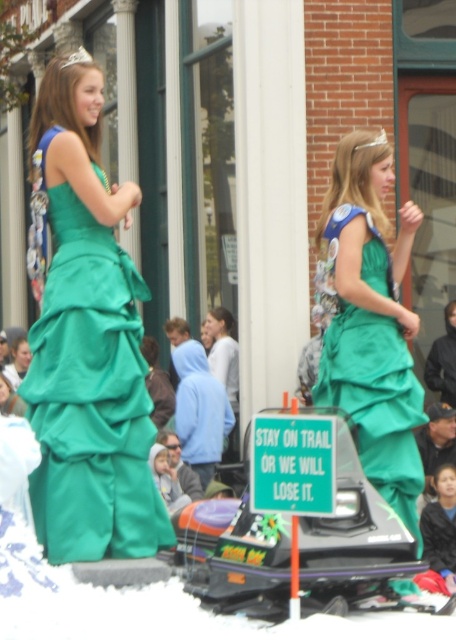
You are a photographer at the event and need to capture a clear photo of both the emerald satin dress at left and the green satin dress at center. Which dress will be more visible in the photo if you focus on the one that is closer to you?

The emerald satin dress at left is positioned over the green satin dress at center, so focusing on the emerald satin dress at left will make it more visible in the photo since it is closer to you.

You are at the parade and want to take a photo of the two points mentioned. Which point is closer to you, point (x=66, y=324) or point (x=412, y=365)?

Point (x=66, y=324) is in front of point (x=412, y=365), so it is closer to you.

You are a photographer at the event and want to capture the emerald satin dress at left. You see a point marked at coordinates point (x=91, y=397). Where is this point located relative to the emerald satin dress at left?

The point (x=91, y=397) is located on the emerald satin dress at left.